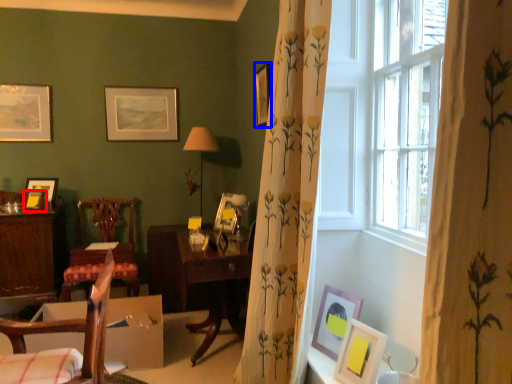
Question: Which object appears farthest to the camera in this image, picture frame (highlighted by a red box) or picture frame (highlighted by a blue box)?

Choices:
 (A) picture frame
 (B) picture frame

Answer: (A)